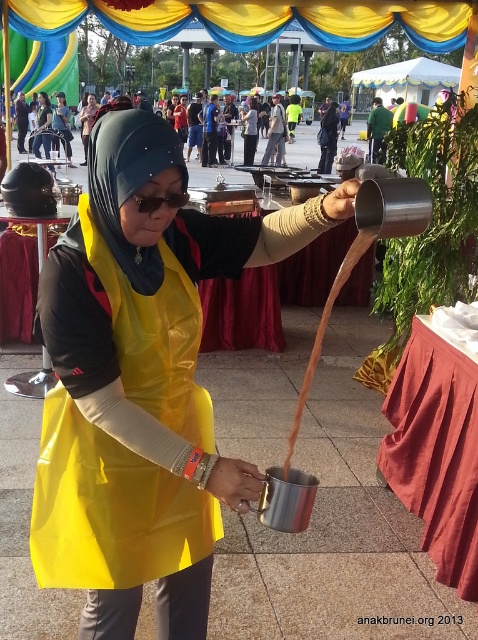
Question: Is metallic yellow apron at center further to camera compared to yellow matte apron at center?

Choices:
 (A) no
 (B) yes

Answer: (A)

Question: Can you confirm if metallic yellow apron at center is positioned to the left of yellow fabric at center?

Choices:
 (A) yes
 (B) no

Answer: (B)

Question: Observing the image, what is the correct spatial positioning of yellow matte apron at center in reference to yellow fabric at center?

Choices:
 (A) right
 (B) left

Answer: (B)

Question: Which object appears closest to the camera in this image?

Choices:
 (A) yellow fabric at center
 (B) matte yellow apron at center

Answer: (B)

Question: Which object is positioned farthest from the yellow matte apron at center?

Choices:
 (A) metallic yellow apron at center
 (B) matte yellow apron at center

Answer: (A)

Question: Estimate the real-world distances between objects in this image. Which object is farther from the yellow fabric at center?

Choices:
 (A) metallic yellow apron at center
 (B) matte yellow apron at center
 (C) yellow matte apron at center

Answer: (A)